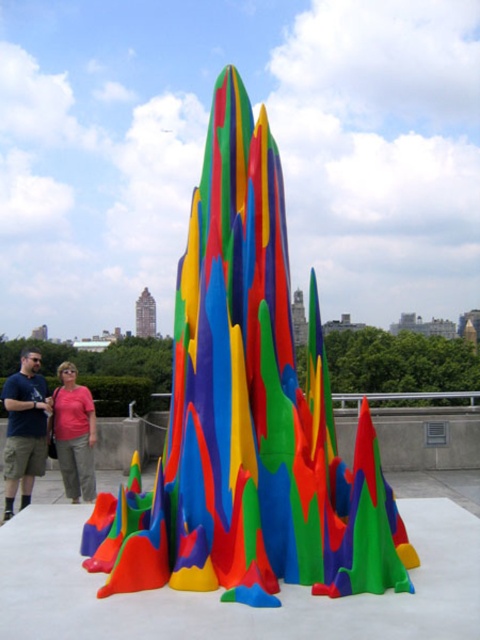
Question: Can you confirm if glossy plastic sculpture at center is thinner than matte black shirt at left?

Choices:
 (A) yes
 (B) no

Answer: (A)

Question: Which object is the farthest from the matte black shirt at left?

Choices:
 (A) glossy plastic sculpture at center
 (B) pink cotton shirt at lower left

Answer: (A)

Question: Among these points, which one is farthest from the camera?

Choices:
 (A) (10, 500)
 (B) (59, 440)

Answer: (B)

Question: Does glossy plastic sculpture at center have a larger size compared to matte black shirt at left?

Choices:
 (A) yes
 (B) no

Answer: (B)

Question: Is glossy plastic sculpture at center wider than matte black shirt at left?

Choices:
 (A) no
 (B) yes

Answer: (A)

Question: Among these points, which one is farthest from the camera?

Choices:
 (A) (25, 412)
 (B) (252, 173)

Answer: (A)